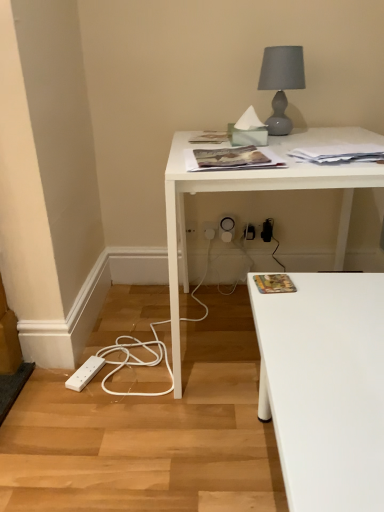
Question: Does white plastic electric outlet at lower center, the second electric outlet positioned from the left, have a smaller size compared to white plastic extension cord at lower left?

Choices:
 (A) yes
 (B) no

Answer: (A)

Question: Is white plastic electric outlet at lower center, the first electric outlet when ordered from right to left, next to white plastic extension cord at lower left?

Choices:
 (A) yes
 (B) no

Answer: (B)

Question: Does white plastic electric outlet at lower center, the second electric outlet positioned from the left, have a lesser width compared to white plastic extension cord at lower left?

Choices:
 (A) yes
 (B) no

Answer: (A)

Question: Could you tell me if white plastic electric outlet at lower center, the second electric outlet positioned from the left, is facing white plastic extension cord at lower left?

Choices:
 (A) yes
 (B) no

Answer: (B)

Question: Can you confirm if white plastic electric outlet at lower center, the second electric outlet positioned from the left, is positioned to the left of white plastic extension cord at lower left?

Choices:
 (A) yes
 (B) no

Answer: (B)

Question: Is white plastic extension cord at lower left at the back of white plastic electric outlet at lower center, the second electric outlet positioned from the left?

Choices:
 (A) yes
 (B) no

Answer: (B)

Question: Would you say matte gray glass table lamp at upper right contains white paper at upper right, placed as the 3th magazine when sorted from top to bottom?

Choices:
 (A) yes
 (B) no

Answer: (B)

Question: Is matte gray glass table lamp at upper right oriented towards white paper at upper right, arranged as the second magazine when ordered from the bottom?

Choices:
 (A) yes
 (B) no

Answer: (A)

Question: Is matte gray glass table lamp at upper right behind white paper at upper right, which is the 2th magazine in back-to-front order?

Choices:
 (A) yes
 (B) no

Answer: (A)

Question: Is matte gray glass table lamp at upper right placed right next to white paper at upper right, placed as the 3th magazine when sorted from top to bottom?

Choices:
 (A) yes
 (B) no

Answer: (B)

Question: Considering the relative positions of matte gray glass table lamp at upper right and white paper at upper right, the third magazine when ordered from front to back, in the image provided, is matte gray glass table lamp at upper right to the right of white paper at upper right, the third magazine when ordered from front to back, from the viewer's perspective?

Choices:
 (A) yes
 (B) no

Answer: (B)

Question: Considering the relative positions of matte gray glass table lamp at upper right and white paper at upper right, the third magazine when ordered from front to back, in the image provided, is matte gray glass table lamp at upper right to the left of white paper at upper right, the third magazine when ordered from front to back, from the viewer's perspective?

Choices:
 (A) no
 (B) yes

Answer: (B)

Question: Considering the relative sizes of white plastic electric outlet at lower center, the second electric outlet positioned from the left, and white paper at upper right, placed as the 3th magazine when sorted from top to bottom, in the image provided, is white plastic electric outlet at lower center, the second electric outlet positioned from the left, thinner than white paper at upper right, placed as the 3th magazine when sorted from top to bottom,?

Choices:
 (A) yes
 (B) no

Answer: (A)